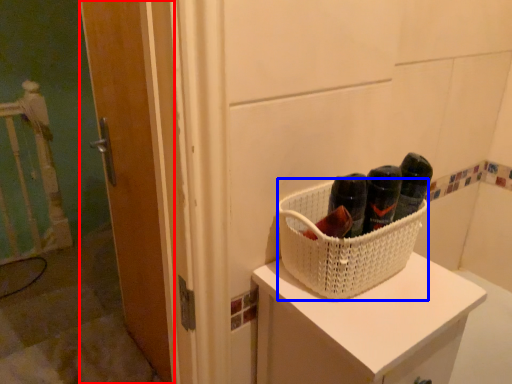
Question: Which object is further to the camera taking this photo, door (highlighted by a red box) or basket (highlighted by a blue box)?

Choices:
 (A) door
 (B) basket

Answer: (A)